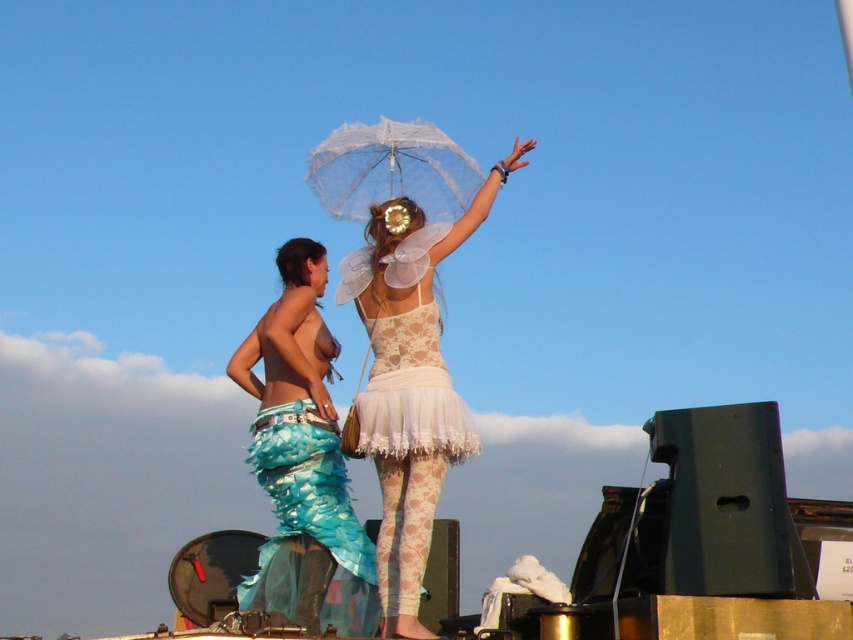
You are a photographer trying to capture the teal fabric mermaid tail at lower left in the image. The camera you are using has a rectangular viewfinder with a fixed aspect ratio of 4x3. The viewfinder can only show objects within its frame. Given that the point marking the teal fabric mermaid tail at lower left is located at coordinates (303, 461), will the entire mermaid tail be visible within the viewfinder if you center the viewfinder on this point?

The point marking the teal fabric mermaid tail at lower left is located at coordinates (303, 461). Since the viewfinder is centered on this point, the entire mermaid tail should be visible within the viewfinder as long as its dimensions do not exceed the viewfinder area. However, without knowing the exact size of the mermaid tail relative to the viewfinder, it is impossible to definitively confirm visibility. The answer provided assumes that the mermaid tail fits within the 4x3 aspect ratio when centered.